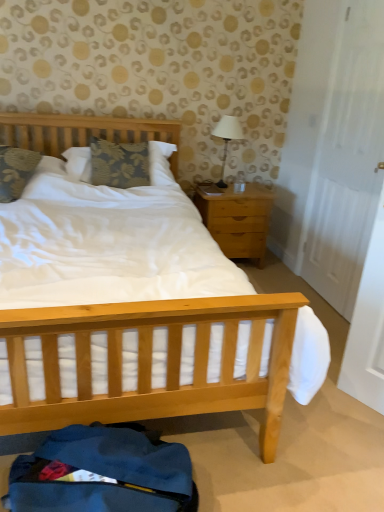
Question: Is floral fabric pillow at left, arranged as the first pillow when viewed from the left, positioned before white matte door at right?

Choices:
 (A) no
 (B) yes

Answer: (A)

Question: Is floral fabric pillow at left, arranged as the first pillow when viewed from the left, next to white matte door at right and touching it?

Choices:
 (A) no
 (B) yes

Answer: (A)

Question: Is the position of floral fabric pillow at left, arranged as the second pillow when viewed from the right, more distant than that of white matte door at right?

Choices:
 (A) no
 (B) yes

Answer: (B)

Question: Can you confirm if floral fabric pillow at left, arranged as the second pillow when viewed from the right, is taller than white matte door at right?

Choices:
 (A) no
 (B) yes

Answer: (A)

Question: From the image's perspective, is floral fabric pillow at left, arranged as the first pillow when viewed from the left, on white matte door at right?

Choices:
 (A) yes
 (B) no

Answer: (B)

Question: Choose the correct answer: Is light wood/texture nightstand at right inside white fabric-covered lamp at upper right or outside it?

Choices:
 (A) inside
 (B) outside

Answer: (B)

Question: Considering the positions of point (195, 197) and point (213, 133), is point (195, 197) closer or farther from the camera than point (213, 133)?

Choices:
 (A) closer
 (B) farther

Answer: (A)

Question: From the image's perspective, is light wood/texture nightstand at right above or below white fabric-covered lamp at upper right?

Choices:
 (A) below
 (B) above

Answer: (A)

Question: Is light wood/texture nightstand at right taller or shorter than white fabric-covered lamp at upper right?

Choices:
 (A) tall
 (B) short

Answer: (A)

Question: Looking at the image, does floral fabric pillow at left, arranged as the first pillow when viewed from the left, seem bigger or smaller compared to floral fabric pillow at center, positioned as the first pillow in right-to-left order?

Choices:
 (A) small
 (B) big

Answer: (A)

Question: Based on their positions, is floral fabric pillow at left, arranged as the first pillow when viewed from the left, located to the left or right of floral fabric pillow at center, positioned as the 2th pillow in left-to-right order?

Choices:
 (A) left
 (B) right

Answer: (A)

Question: Is floral fabric pillow at left, arranged as the first pillow when viewed from the left, in front of or behind floral fabric pillow at center, positioned as the 2th pillow in left-to-right order, in the image?

Choices:
 (A) front
 (B) behind

Answer: (A)

Question: From a real-world perspective, is floral fabric pillow at left, arranged as the first pillow when viewed from the left, physically located above or below floral fabric pillow at center, positioned as the 2th pillow in left-to-right order?

Choices:
 (A) above
 (B) below

Answer: (B)

Question: Is point (306, 268) positioned closer to the camera than point (114, 151)?

Choices:
 (A) farther
 (B) closer

Answer: (A)

Question: Is white matte door at right bigger or smaller than floral fabric pillow at center, positioned as the 2th pillow in left-to-right order?

Choices:
 (A) small
 (B) big

Answer: (A)